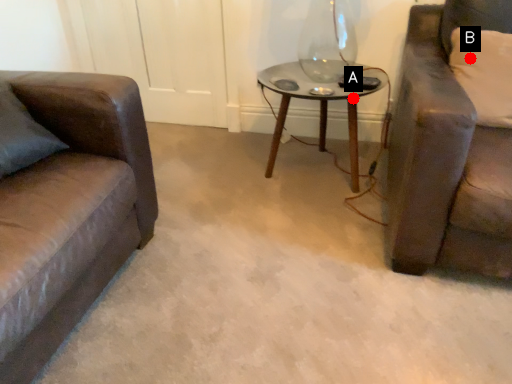
Question: Two points are circled on the image, labeled by A and B beside each circle. Which point is farther to the camera?

Choices:
 (A) A is further
 (B) B is further

Answer: (A)